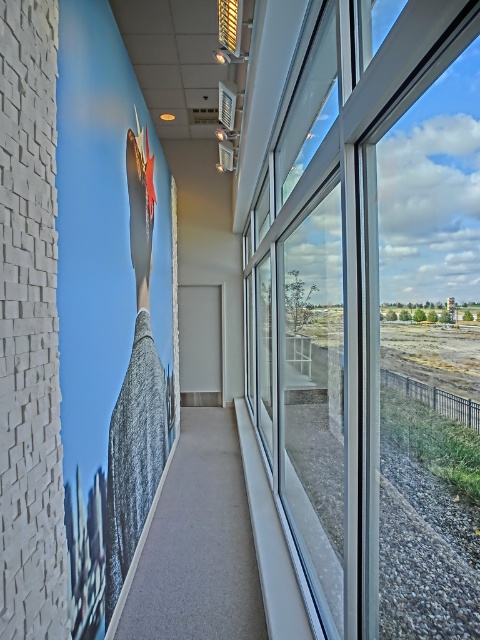
You are standing in the hallway and want to see the outdoor landscape clearly. Which object, the transparent glass window at right or the gray fabric at left, would allow you to have a better view?

The transparent glass window at right is bigger than the gray fabric at left, so it would provide a better view of the outdoor landscape.